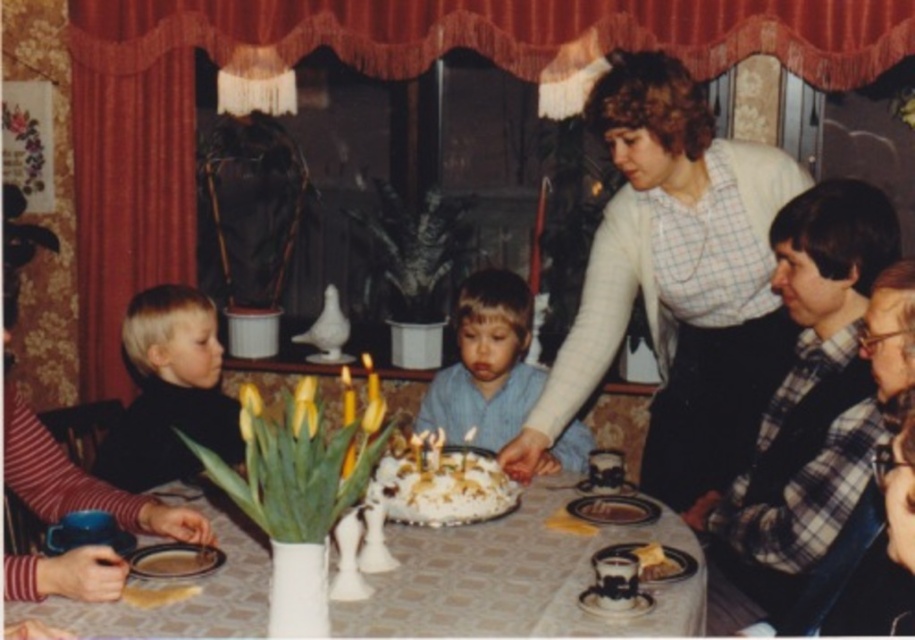
Who is higher up, white frosted cake at center or smooth chocolate cake at center?

white frosted cake at center

In the scene shown: Is white frosted cake at center thinner than smooth chocolate cake at center?

In fact, white frosted cake at center might be wider than smooth chocolate cake at center.

Which is in front, point (449, 500) or point (604, 508)?

Point (449, 500) is in front.

The image size is (915, 640). I want to click on white frosted cake at center, so click(x=439, y=483).

Based on the photo, is white textured tablecloth at center to the right of smooth black shirt at left from the viewer's perspective?

Yes, white textured tablecloth at center is to the right of smooth black shirt at left.

The image size is (915, 640). Describe the element at coordinates (515, 579) in the screenshot. I see `white textured tablecloth at center` at that location.

Find the location of a particular element. This screenshot has width=915, height=640. white textured tablecloth at center is located at coordinates (515, 579).

Does smooth black shirt at left have a larger size compared to golden flaky pastry at center?

Correct, smooth black shirt at left is larger in size than golden flaky pastry at center.

Between smooth black shirt at left and golden flaky pastry at center, which one is positioned lower?

golden flaky pastry at center

Describe the element at coordinates (169, 392) in the screenshot. The height and width of the screenshot is (640, 915). I see `smooth black shirt at left` at that location.

Locate an element on the screen. The image size is (915, 640). smooth black shirt at left is located at coordinates (169, 392).